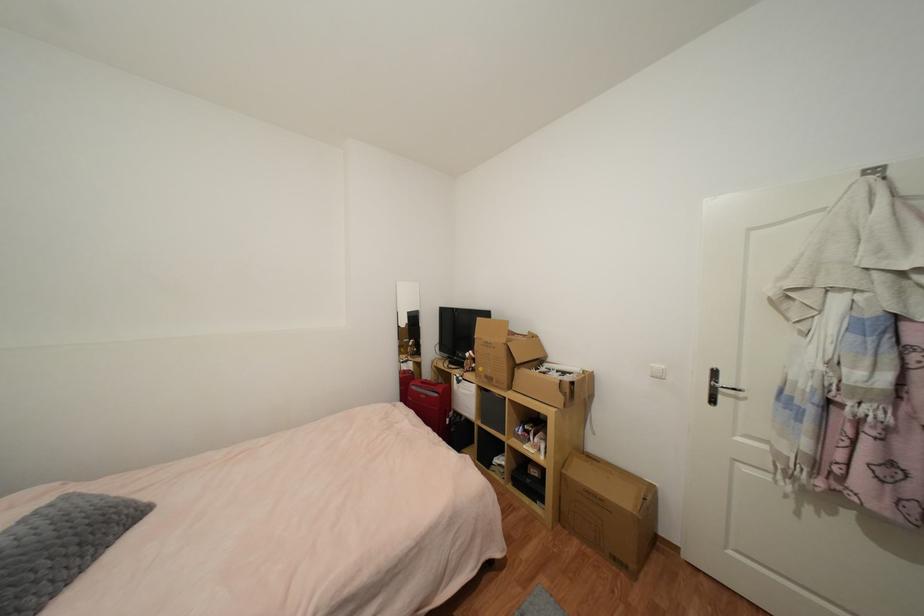
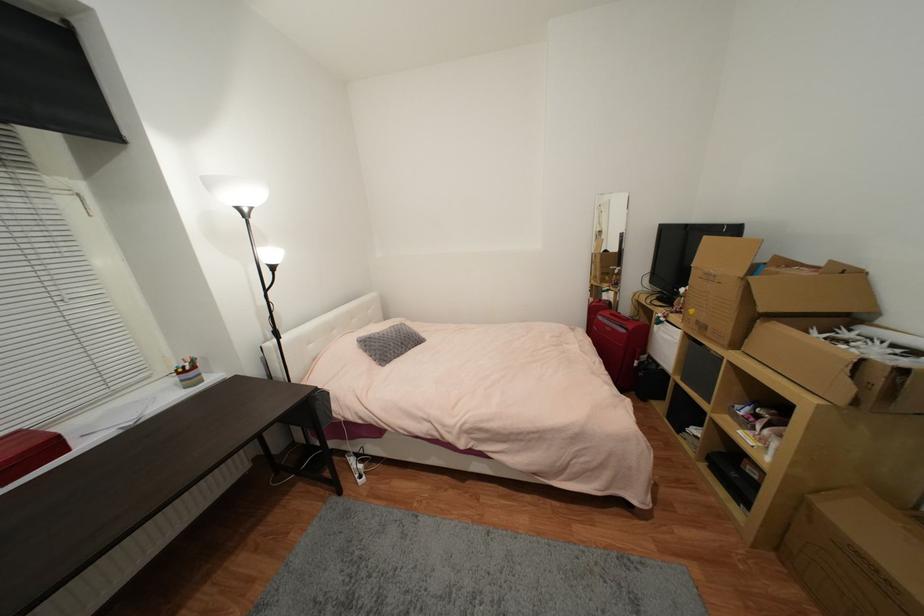
Find the pixel in the second image that matches pixel 565 400 in the first image.

(852, 390)